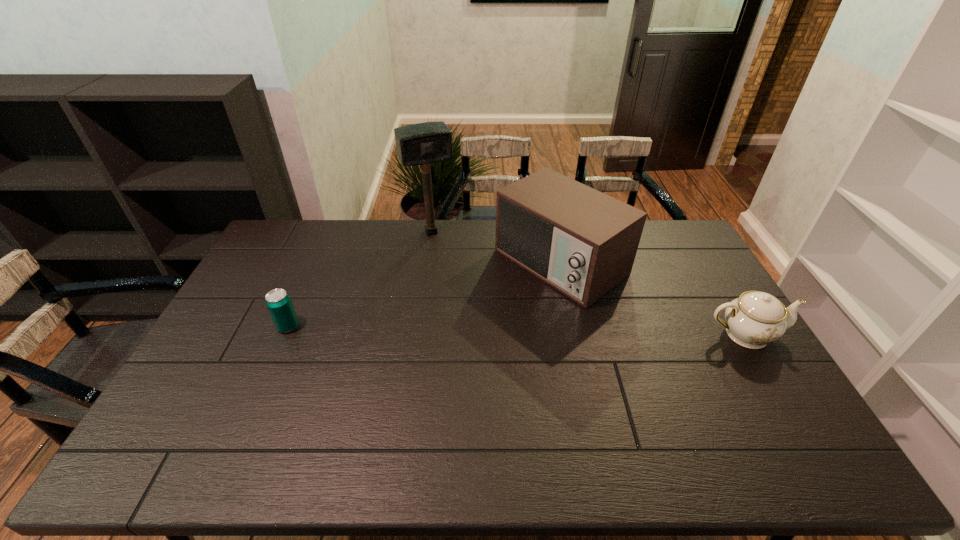
Where is `vacant spot on the desktop that is between the shortest object and the chinaware and is positioned on the front-facing side of the third object from left to right`? The height and width of the screenshot is (540, 960). vacant spot on the desktop that is between the shortest object and the chinaware and is positioned on the front-facing side of the third object from left to right is located at coordinates (458, 329).

The width and height of the screenshot is (960, 540). What are the coordinates of `free space on the desktop that is between the beer can and the rightmost object and is positioned on the head of the third object from right to left` in the screenshot? It's located at (482, 330).